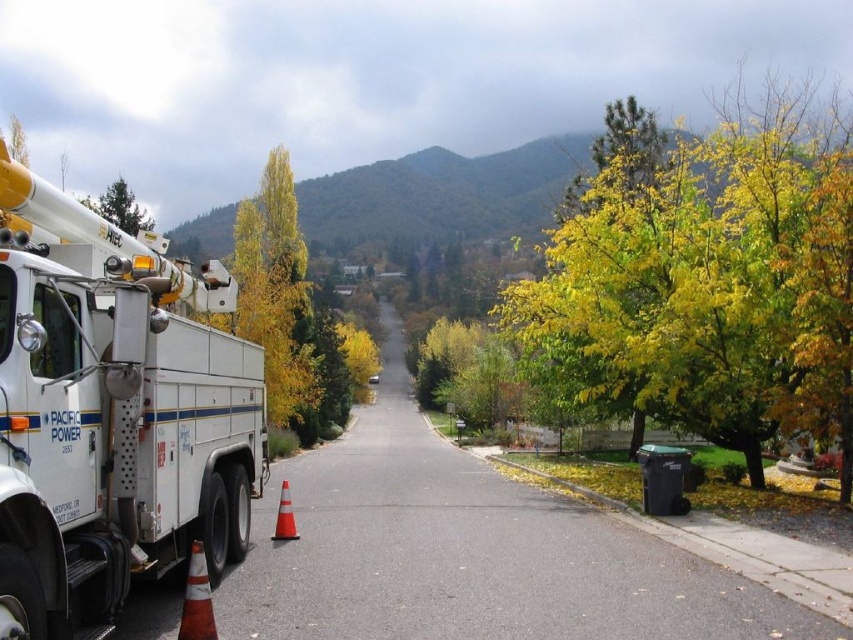
Who is higher up, yellow/golden leaves at upper right or green leafy tree at upper left?

yellow/golden leaves at upper right

Locate an element on the screen. The height and width of the screenshot is (640, 853). yellow/golden leaves at upper right is located at coordinates (711, 278).

Is point (775, 156) behind point (148, 227)?

No, (775, 156) is in front of (148, 227).

Identify the location of yellow/golden leaves at upper right. The height and width of the screenshot is (640, 853). (711, 278).

Between orange reflective cone at lower left and green leafy tree at upper left, which one is positioned higher?

green leafy tree at upper left is higher up.

Is orange reflective cone at lower left bigger than green leafy tree at upper left?

Actually, orange reflective cone at lower left might be smaller than green leafy tree at upper left.

Describe the element at coordinates (196, 598) in the screenshot. I see `orange reflective cone at lower left` at that location.

In order to click on orange reflective cone at lower left in this screenshot , I will do `click(196, 598)`.

Image resolution: width=853 pixels, height=640 pixels. I want to click on yellow/golden leaves at upper right, so click(711, 278).

Who is more forward, (712,166) or (202,609)?

Point (202,609) is in front.

Locate an element on the screen. The width and height of the screenshot is (853, 640). yellow/golden leaves at upper right is located at coordinates (711, 278).